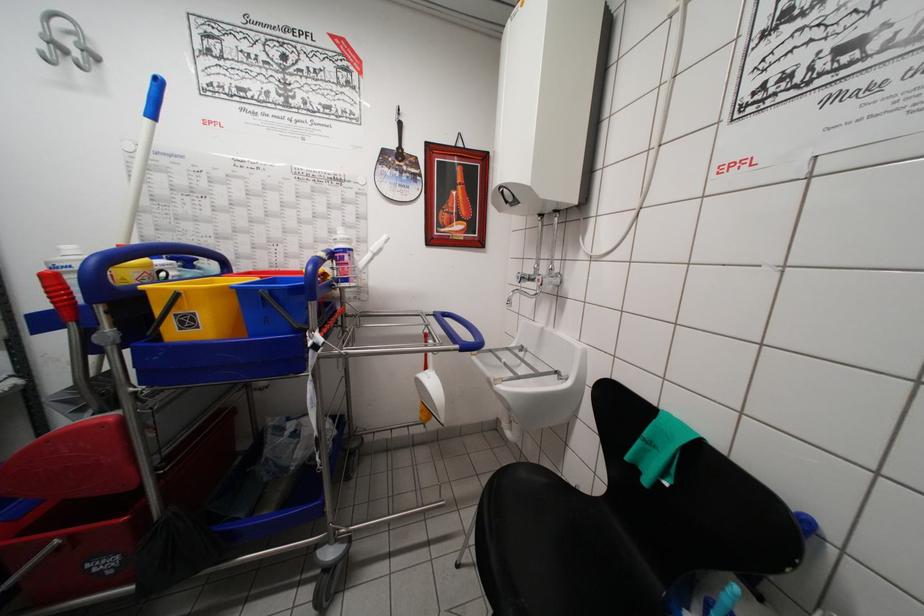
At what (x,y) coordinates should I click in order to perform the action: click on grey wall hook. Please return your answer as a coordinate pair (x, y). Looking at the image, I should click on (65, 42).